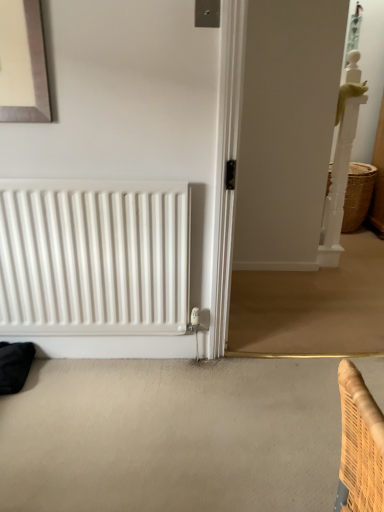
Question: Is white glossy screen door at right inside or outside of white matte radiator at lower left?

Choices:
 (A) outside
 (B) inside

Answer: (A)

Question: Is white glossy screen door at right bigger or smaller than white matte radiator at lower left?

Choices:
 (A) big
 (B) small

Answer: (A)

Question: Which object is positioned farthest from the white glossy screen door at right?

Choices:
 (A) woven straw basket at right
 (B) white matte radiator at lower left

Answer: (B)

Question: Considering the real-world distances, which object is closest to the white glossy screen door at right?

Choices:
 (A) white matte radiator at lower left
 (B) woven straw basket at right

Answer: (B)